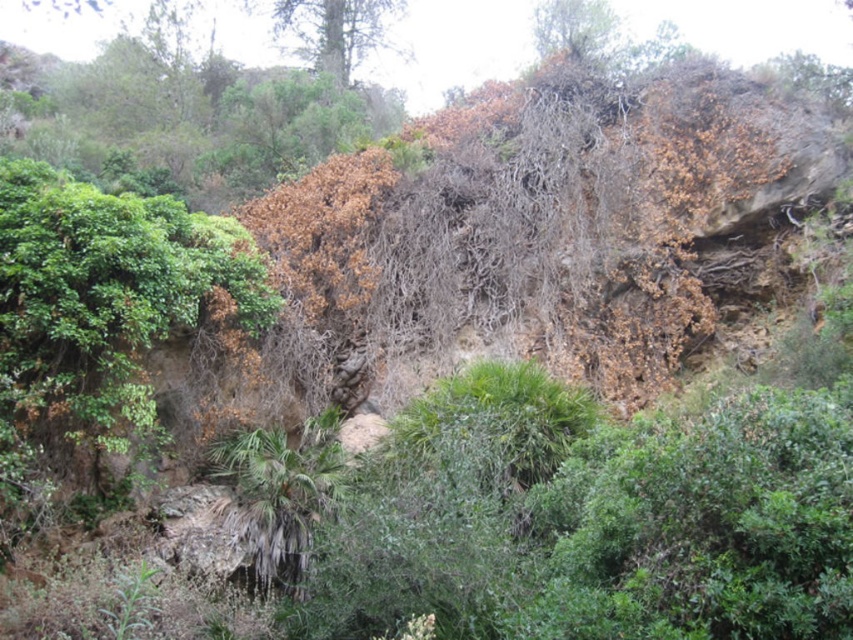
Question: Among these points, which one is farthest from the camera?

Choices:
 (A) (548, 45)
 (B) (354, 45)

Answer: (B)

Question: Is green leafy tree at upper center bigger than brown textured tree at upper center?

Choices:
 (A) no
 (B) yes

Answer: (B)

Question: Which of the following is the farthest from the observer?

Choices:
 (A) green leafy tree at upper center
 (B) brown textured tree at upper center

Answer: (A)

Question: Can you confirm if green leafy tree at upper center is smaller than brown textured tree at upper center?

Choices:
 (A) yes
 (B) no

Answer: (B)

Question: Can you confirm if green leafy tree at upper center is thinner than brown textured tree at upper center?

Choices:
 (A) no
 (B) yes

Answer: (A)

Question: Among these points, which one is farthest from the camera?

Choices:
 (A) (583, 8)
 (B) (312, 13)

Answer: (B)